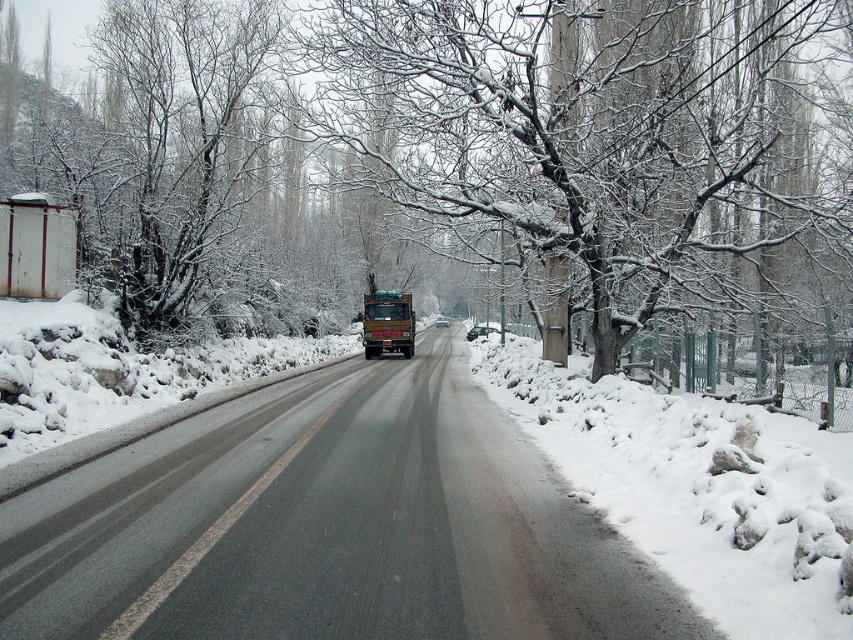
Is white fluffy snow at right taller than matte brown truck at center?

Incorrect, white fluffy snow at right's height is not larger of matte brown truck at center's.

Does white fluffy snow at right have a lesser width compared to matte brown truck at center?

In fact, white fluffy snow at right might be wider than matte brown truck at center.

Is point (640, 408) closer to viewer compared to point (366, 298)?

Yes, it is.

The image size is (853, 640). Find the location of `white fluffy snow at right`. white fluffy snow at right is located at coordinates (691, 490).

Is snow-covered branches at center to the left of metallic truck at center from the viewer's perspective?

In fact, snow-covered branches at center is to the right of metallic truck at center.

Which is in front, point (457, 154) or point (374, 566)?

Positioned in front is point (374, 566).

The image size is (853, 640). Find the location of `snow-covered branches at center`. snow-covered branches at center is located at coordinates (601, 138).

At what (x,y) coordinates should I click in order to perform the action: click on snow-covered branches at center. Please return your answer as a coordinate pair (x, y). Looking at the image, I should click on (601, 138).

Can you confirm if snow-covered branches at center is positioned to the right of matte brown truck at center?

Indeed, snow-covered branches at center is positioned on the right side of matte brown truck at center.

Can you confirm if snow-covered branches at center is thinner than matte brown truck at center?

Incorrect, snow-covered branches at center's width is not less than matte brown truck at center's.

Who is more forward, [494,170] or [378,328]?

Point [494,170] is in front.

This screenshot has height=640, width=853. Find the location of `snow-covered branches at center`. snow-covered branches at center is located at coordinates (601, 138).